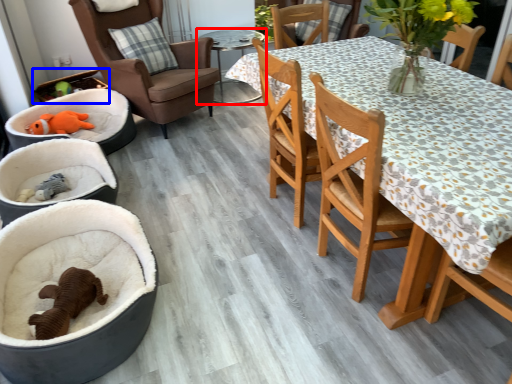
Question: Which of the following is the closest to the observer, table (highlighted by a red box) or laundry basket (highlighted by a blue box)?

Choices:
 (A) table
 (B) laundry basket

Answer: (B)